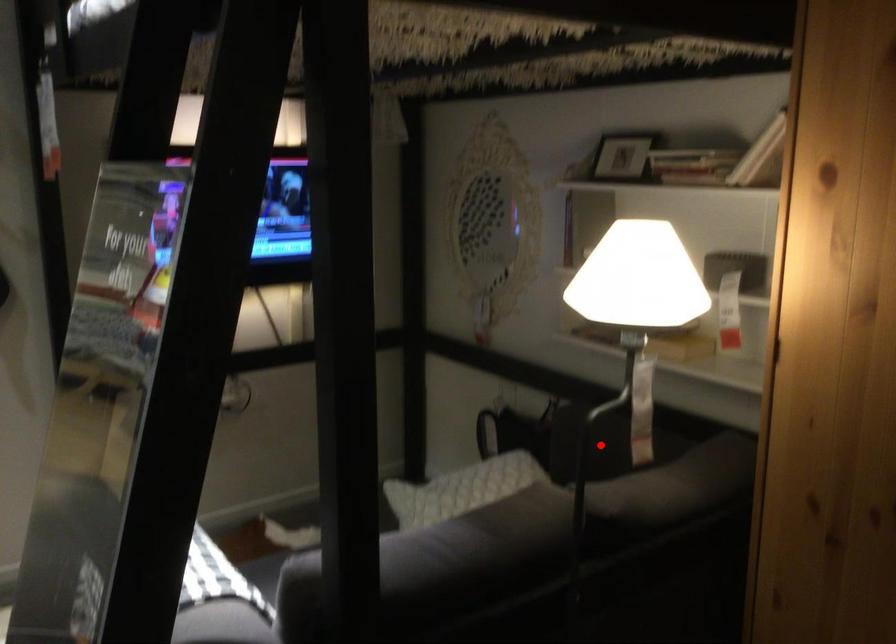
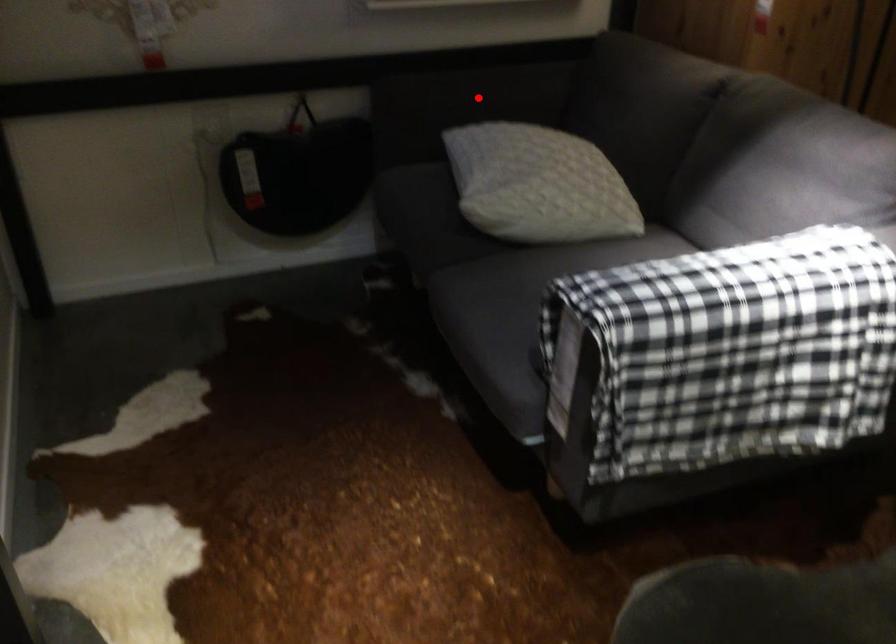
I am providing you with two images of the same scene from different viewpoints. A red point is marked on the first image and another point is marked on the second image. Are the points marked in image1 and image2 representing the same 3D position?

Yes